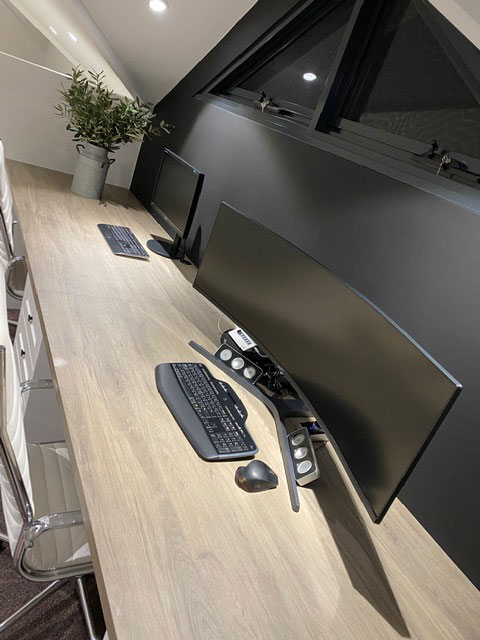
Where is `wooden table empty space`? wooden table empty space is located at coordinates (318, 600), (145, 544), (435, 582), (104, 408), (162, 296), (54, 250), (122, 205).